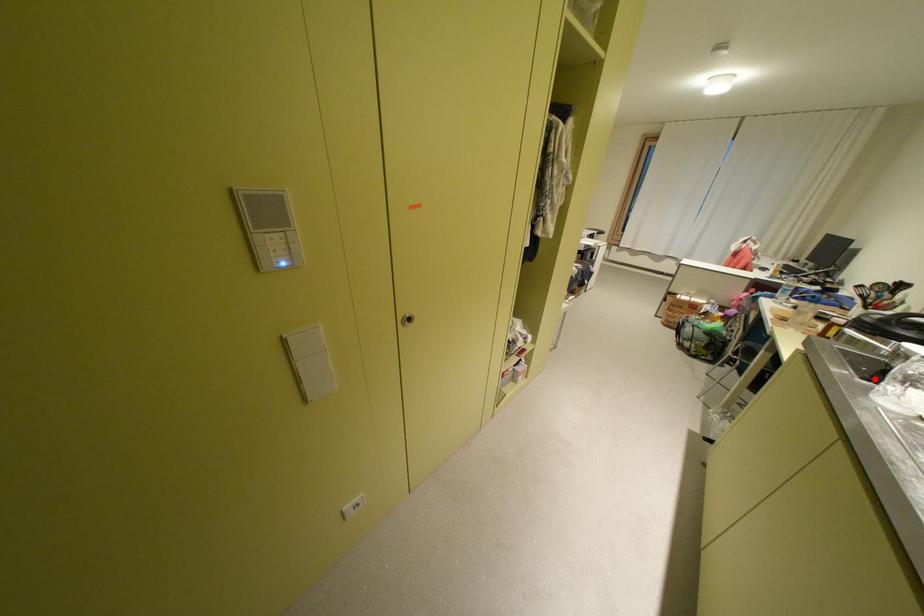
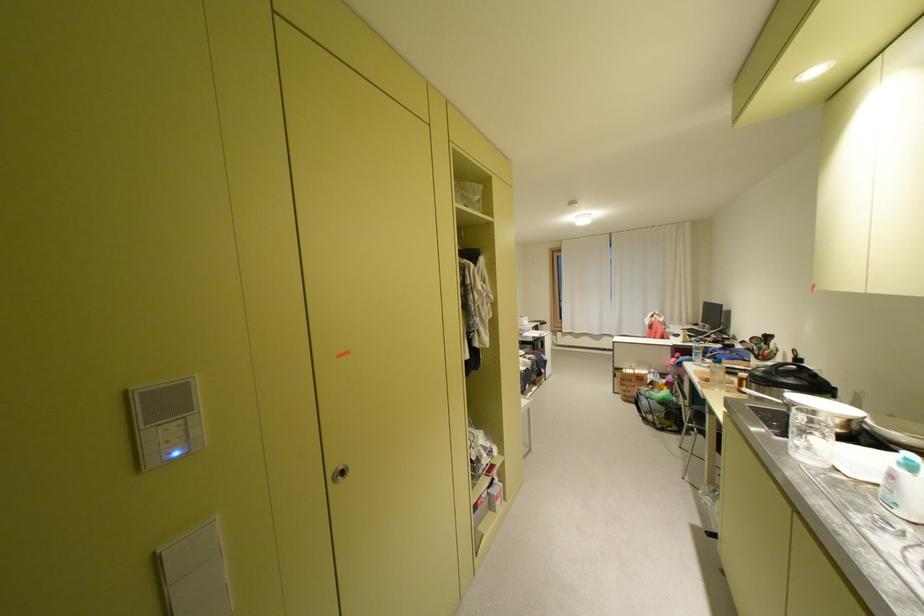
In the second image, find the point that corresponds to the highlighted location in the first image.

(789, 436)